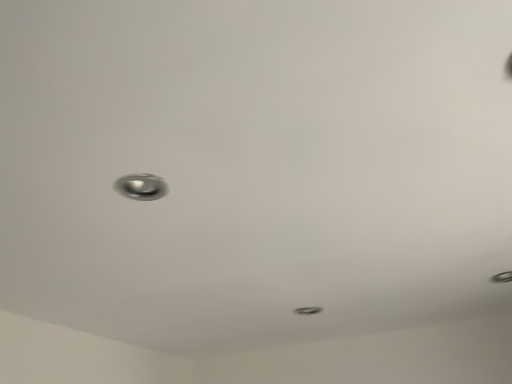
This screenshot has width=512, height=384. What are the coordinates of `satin silver door handle at center` in the screenshot? It's located at (141, 187).

The image size is (512, 384). What do you see at coordinates (141, 187) in the screenshot?
I see `satin silver door handle at center` at bounding box center [141, 187].

Image resolution: width=512 pixels, height=384 pixels. In order to click on satin silver door handle at center in this screenshot , I will do `click(141, 187)`.